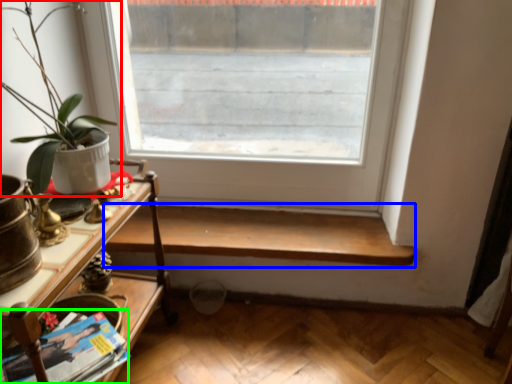
Question: Which object is positioned closest to houseplant (highlighted by a red box)? Select from shelf (highlighted by a blue box) and magazine (highlighted by a green box).

Choices:
 (A) shelf
 (B) magazine

Answer: (B)